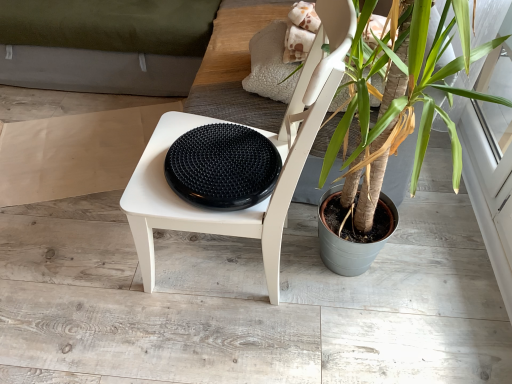
Identify the location of black rubber disc at center. Image resolution: width=512 pixels, height=384 pixels. (222, 167).

Identify the location of black rubber disc at center. (222, 167).

From the image's perspective, is beige paper at left below black rubber disc at center?

No, from the image's perspective, beige paper at left is not beneath black rubber disc at center.

Considering the relative sizes of beige paper at left and black rubber disc at center in the image provided, is beige paper at left smaller than black rubber disc at center?

No, beige paper at left is not smaller than black rubber disc at center.

Is beige paper at left looking in the opposite direction of black rubber disc at center?

No, beige paper at left is not facing the opposite direction of black rubber disc at center.

Considering the sizes of objects green leafy plant at center and white matte chair at center in the image provided, who is taller, green leafy plant at center or white matte chair at center?

green leafy plant at center.

Image resolution: width=512 pixels, height=384 pixels. In order to click on chair behind the green leafy plant at center in this screenshot , I will do `click(256, 130)`.

Looking at this image, from a real-world perspective, which is physically above, green leafy plant at center or white matte chair at center?

From a 3D spatial view, green leafy plant at center is above.

Is green leafy plant at center closer to camera compared to white matte chair at center?

Yes, it is.

Can you confirm if green leafy plant at center is positioned to the left of beige paper at left?

No.

Is green leafy plant at center in contact with beige paper at left?

They are not placed beside each other.

From a real-world perspective, is green leafy plant at center physically below beige paper at left?

No, from a real-world perspective, green leafy plant at center is not below beige paper at left.

Measure the distance between green leafy plant at center and beige paper at left.

3.78 feet.

Which is more to the right, black rubber disc at center or white matte chair at center?

Positioned to the right is white matte chair at center.

Does point (244, 142) appear closer or farther from the camera than point (148, 259)?

Point (244, 142) is positioned closer to the camera compared to point (148, 259).

From a real-world perspective, is black rubber disc at center below white matte chair at center?

No, from a real-world perspective, black rubber disc at center is not under white matte chair at center.

How distant is black rubber disc at center from white matte chair at center?

The distance of black rubber disc at center from white matte chair at center is 4.90 inches.

Considering the positions of objects black rubber disc at center and beige paper at left in the image provided, who is more to the right, black rubber disc at center or beige paper at left?

black rubber disc at center is more to the right.

Considering the sizes of objects black rubber disc at center and beige paper at left in the image provided, who is thinner, black rubber disc at center or beige paper at left?

black rubber disc at center is thinner.

The width and height of the screenshot is (512, 384). I want to click on manhole cover located below the beige paper at left (from the image's perspective), so click(222, 167).

Does beige paper at left have a smaller size compared to green leafy plant at center?

Correct, beige paper at left occupies less space than green leafy plant at center.

Considering the sizes of beige paper at left and green leafy plant at center in the image, is beige paper at left taller or shorter than green leafy plant at center?

Clearly, beige paper at left is shorter compared to green leafy plant at center.

Is beige paper at left directly adjacent to green leafy plant at center?

No.

Considering the sizes of objects white matte chair at center and black rubber disc at center in the image provided, who is bigger, white matte chair at center or black rubber disc at center?

With larger size is white matte chair at center.

Is white matte chair at center placed right next to black rubber disc at center?

No, white matte chair at center is not with black rubber disc at center.

Is white matte chair at center at the left side of black rubber disc at center?

Incorrect, white matte chair at center is not on the left side of black rubber disc at center.

From a real-world perspective, which is physically above, white matte chair at center or black rubber disc at center?

From a 3D spatial view, black rubber disc at center is above.

Locate an element on the screen. cardboard below the black rubber disc at center (from a real-world perspective) is located at coordinates (74, 153).

This screenshot has height=384, width=512. I want to click on chair lying below the green leafy plant at center (from the image's perspective), so click(256, 130).

Estimate the real-world distances between objects in this image. Which object is further from black rubber disc at center, beige paper at left or white matte chair at center?

Based on the image, beige paper at left appears to be further to black rubber disc at center.

When comparing their distances from black rubber disc at center, does green leafy plant at center or beige paper at left seem closer?

green leafy plant at center lies closer to black rubber disc at center than the other object.

Considering their positions, is white matte chair at center positioned further to beige paper at left than black rubber disc at center?

The object further to beige paper at left is black rubber disc at center.

Estimate the real-world distances between objects in this image. Which object is further from white matte chair at center, green leafy plant at center or black rubber disc at center?

green leafy plant at center.

Looking at the image, which one is located closer to green leafy plant at center, black rubber disc at center or beige paper at left?

Among the two, black rubber disc at center is located nearer to green leafy plant at center.

Considering their positions, is green leafy plant at center positioned closer to black rubber disc at center than white matte chair at center?

Based on the image, white matte chair at center appears to be nearer to black rubber disc at center.

From the image, which object appears to be farther from beige paper at left, white matte chair at center or green leafy plant at center?

Based on the image, green leafy plant at center appears to be further to beige paper at left.

Which object lies nearer to the anchor point black rubber disc at center, white matte chair at center or beige paper at left?

Based on the image, white matte chair at center appears to be nearer to black rubber disc at center.

This screenshot has width=512, height=384. Identify the location of manhole cover between green leafy plant at center and beige paper at left from front to back. (222, 167).

Locate an element on the screen. chair between green leafy plant at center and black rubber disc at center along the z-axis is located at coordinates (256, 130).

In order to click on manhole cover between white matte chair at center and beige paper at left from front to back in this screenshot , I will do `click(222, 167)`.

Locate an element on the screen. Image resolution: width=512 pixels, height=384 pixels. chair between green leafy plant at center and beige paper at left in the front-back direction is located at coordinates (256, 130).